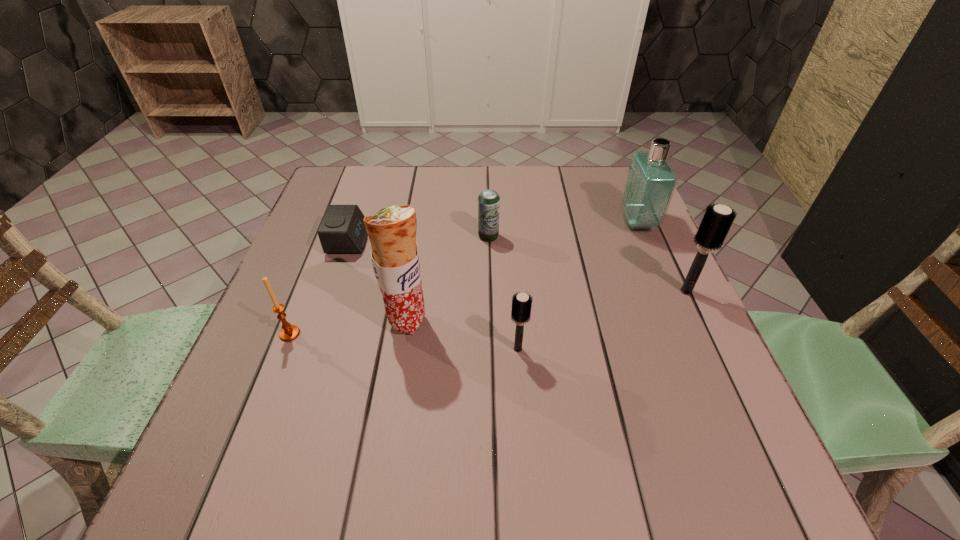
The image size is (960, 540). Find the location of `object present at the far edge`. object present at the far edge is located at coordinates (650, 183).

Locate an element on the screen. The height and width of the screenshot is (540, 960). alarm clock at the left edge is located at coordinates (342, 230).

The image size is (960, 540). What are the coordinates of `candle_holder that is at the left edge` in the screenshot? It's located at (289, 332).

You are a GUI agent. You are given a task and a screenshot of the screen. Output one action in this format:
    pyautogui.click(x=<x>, y=<y>)
    Task: Click on the hairbrush positioned at the right edge
    This screenshot has width=960, height=540.
    Given the screenshot: What is the action you would take?
    pyautogui.click(x=717, y=220)

This screenshot has height=540, width=960. Find the location of `perfume present at the right edge`. perfume present at the right edge is located at coordinates (650, 183).

Locate an element on the screen. The height and width of the screenshot is (540, 960). object that is positioned at the far right corner is located at coordinates (650, 183).

Find the location of a particular element. The width and height of the screenshot is (960, 540). vacant space at the far edge is located at coordinates (568, 208).

Find the location of a particular element. The height and width of the screenshot is (540, 960). free point at the near edge is located at coordinates (567, 426).

You are a GUI agent. You are given a task and a screenshot of the screen. Output one action in this format:
    pyautogui.click(x=<x>, y=<y>)
    Task: Click on the vacant region at the left edge of the desktop
    
    Given the screenshot: What is the action you would take?
    pyautogui.click(x=303, y=329)

I want to click on vacant region at the right edge of the desktop, so (708, 370).